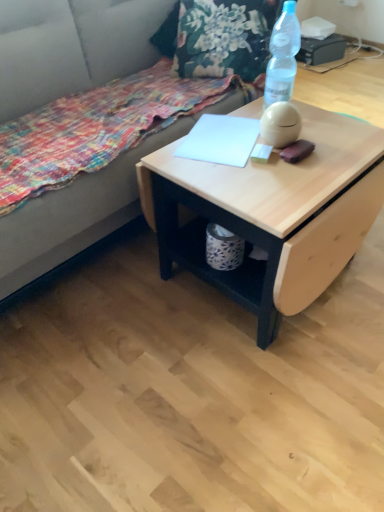
Question: Is fabric couch at upper left to the left or to the right of white paper at center in the image?

Choices:
 (A) right
 (B) left

Answer: (B)

Question: From the image's perspective, is fabric couch at upper left positioned above or below white paper at center?

Choices:
 (A) above
 (B) below

Answer: (A)

Question: Considering the real-world distances, which object is closest to the white paper at center?

Choices:
 (A) floral fabric blanket at lower left
 (B) transparent plastic bottle at upper right
 (C) fabric couch at upper left
 (D) natural wood desk at center

Answer: (B)

Question: Which object is the closest to the transparent plastic bottle at upper right?

Choices:
 (A) natural wood desk at center
 (B) floral fabric blanket at lower left
 (C) white paper at center
 (D) fabric couch at upper left

Answer: (C)